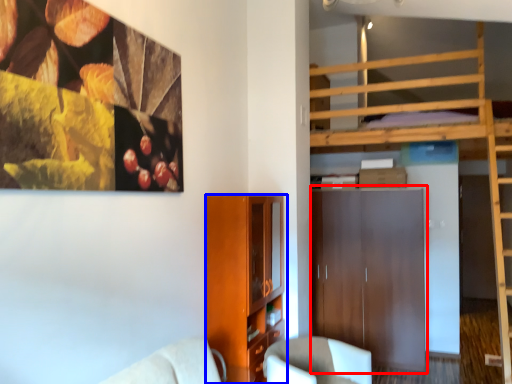
Question: Among these objects, which one is farthest to the camera, dresser (highlighted by a red box) or cabinetry (highlighted by a blue box)?

Choices:
 (A) dresser
 (B) cabinetry

Answer: (A)